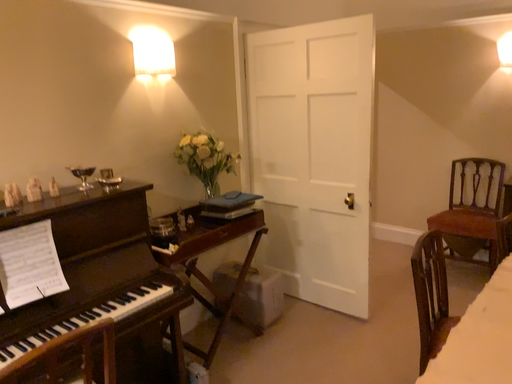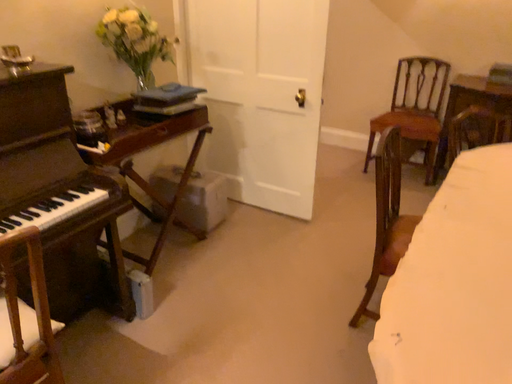
Question: Which way did the camera rotate in the video?

Choices:
 (A) rotated downward
 (B) rotated upward

Answer: (A)